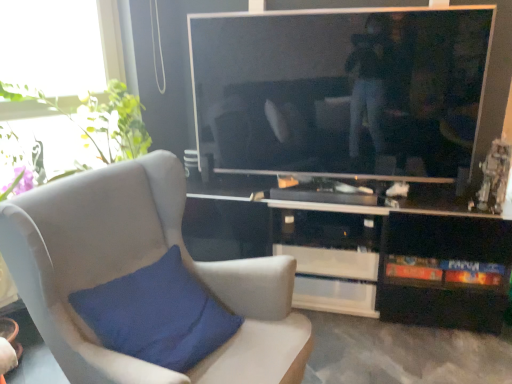
Image resolution: width=512 pixels, height=384 pixels. Find the location of `suede-like beige chair at left`. suede-like beige chair at left is located at coordinates (136, 269).

This screenshot has width=512, height=384. Identify the location of suede-like beige chair at left. (x=136, y=269).

Between suede-like beige chair at left and black glossy cabinet at lower right, which one has smaller size?

black glossy cabinet at lower right.

Image resolution: width=512 pixels, height=384 pixels. Identify the location of cabinetry on the right of suede-like beige chair at left. (394, 258).

In terms of width, does suede-like beige chair at left look wider or thinner when compared to black glossy cabinet at lower right?

suede-like beige chair at left is wider than black glossy cabinet at lower right.

Which of these two, suede-like beige chair at left or black glossy cabinet at lower right, stands shorter?

black glossy cabinet at lower right.

From their relative heights in the image, would you say black glossy cabinet at lower right is taller or shorter than green leafy plant at upper left?

Clearly, black glossy cabinet at lower right is taller compared to green leafy plant at upper left.

From a real-world perspective, is black glossy cabinet at lower right positioned under green leafy plant at upper left based on gravity?

Yes, from a real-world perspective, black glossy cabinet at lower right is below green leafy plant at upper left.

Is black glossy cabinet at lower right at the right side of green leafy plant at upper left?

Yes, black glossy cabinet at lower right is to the right of green leafy plant at upper left.

Identify the location of plant above the black glossy cabinet at lower right (from a real-world perspective). The width and height of the screenshot is (512, 384). (99, 119).

In the image, there is a black glossy cabinet at lower right. At what (x,y) coordinates should I click in order to perform the action: click on plant above it (from the image's perspective). Please return your answer as a coordinate pair (x, y). The image size is (512, 384). Looking at the image, I should click on (99, 119).

What's the angular difference between green leafy plant at upper left and black glossy cabinet at lower right's facing directions?

green leafy plant at upper left and black glossy cabinet at lower right are facing 50.4 degrees away from each other.

Is black glossy cabinet at lower right surrounded by green leafy plant at upper left?

Definitely not — black glossy cabinet at lower right is not inside green leafy plant at upper left.

Visually, is black glossy cabinet at lower right positioned to the left or to the right of suede-like beige chair at left?

In the image, black glossy cabinet at lower right appears on the right side of suede-like beige chair at left.

Which is farther, (377, 285) or (242, 353)?

Positioned behind is point (377, 285).

Does black glossy cabinet at lower right have a smaller size compared to suede-like beige chair at left?

Yes.

Is the surface of black glossy cabinet at lower right in direct contact with suede-like beige chair at left?

No.

Between green leafy plant at upper left and suede-like beige chair at left, which one appears on the right side from the viewer's perspective?

Positioned to the right is suede-like beige chair at left.

From the image's perspective, relative to suede-like beige chair at left, is green leafy plant at upper left above or below?

green leafy plant at upper left is situated higher than suede-like beige chair at left in the image.

Is green leafy plant at upper left further to camera compared to suede-like beige chair at left?

Yes, green leafy plant at upper left is behind suede-like beige chair at left.

Is green leafy plant at upper left not close to suede-like beige chair at left?

Yes, green leafy plant at upper left is far from suede-like beige chair at left.

Is suede-like beige chair at left far away from green leafy plant at upper left?

Yes, suede-like beige chair at left and green leafy plant at upper left are quite far apart.

Considering their positions, is suede-like beige chair at left located in front of or behind green leafy plant at upper left?

suede-like beige chair at left is in front of green leafy plant at upper left.

Does suede-like beige chair at left turn towards green leafy plant at upper left?

No, suede-like beige chair at left is not oriented towards green leafy plant at upper left.

Which is closer, (246,276) or (117,83)?

Point (246,276) is closer to the camera than point (117,83).

Where is `chair below the black glossy cabinet at lower right (from the image's perspective)`? chair below the black glossy cabinet at lower right (from the image's perspective) is located at coordinates (136, 269).

At what (x,y) coordinates should I click in order to perform the action: click on plant lying above the black glossy cabinet at lower right (from the image's perspective). Please return your answer as a coordinate pair (x, y). Image resolution: width=512 pixels, height=384 pixels. Looking at the image, I should click on (99, 119).

Considering their positions, is black glossy cabinet at lower right positioned closer to suede-like beige chair at left than green leafy plant at upper left?

black glossy cabinet at lower right is closer to suede-like beige chair at left.

Estimate the real-world distances between objects in this image. Which object is further from black glossy cabinet at lower right, suede-like beige chair at left or green leafy plant at upper left?

green leafy plant at upper left is positioned further to the anchor black glossy cabinet at lower right.

When comparing their distances from black glossy cabinet at lower right, does green leafy plant at upper left or suede-like beige chair at left seem further?

green leafy plant at upper left lies further to black glossy cabinet at lower right than the other object.

From the image, which object appears to be nearer to suede-like beige chair at left, green leafy plant at upper left or black glossy cabinet at lower right?

black glossy cabinet at lower right is positioned closer to the anchor suede-like beige chair at left.

Considering their positions, is suede-like beige chair at left positioned further to green leafy plant at upper left than black glossy cabinet at lower right?

Based on the image, black glossy cabinet at lower right appears to be further to green leafy plant at upper left.

Considering their positions, is black glossy cabinet at lower right positioned further to green leafy plant at upper left than suede-like beige chair at left?

Based on the image, black glossy cabinet at lower right appears to be further to green leafy plant at upper left.

Where is `chair between green leafy plant at upper left and black glossy cabinet at lower right`? The width and height of the screenshot is (512, 384). chair between green leafy plant at upper left and black glossy cabinet at lower right is located at coordinates (136, 269).